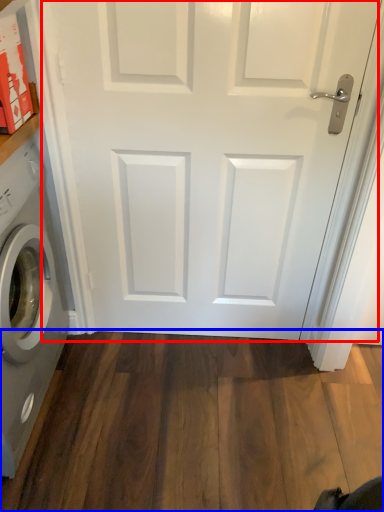
Question: Which object is closer to the camera taking this photo, door (highlighted by a red box) or hardwood (highlighted by a blue box)?

Choices:
 (A) door
 (B) hardwood

Answer: (A)